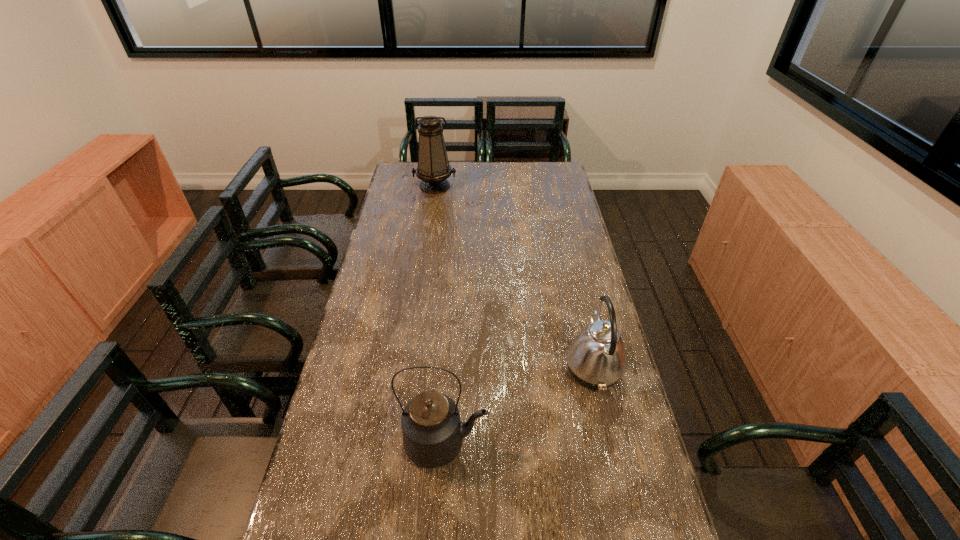
The height and width of the screenshot is (540, 960). Identify the location of object that is at the far edge. (433, 169).

Where is `object present at the left edge`? Image resolution: width=960 pixels, height=540 pixels. object present at the left edge is located at coordinates (433, 169).

This screenshot has width=960, height=540. Identify the location of object situated at the right edge. (596, 358).

The image size is (960, 540). Find the location of `object located at the far left corner`. object located at the far left corner is located at coordinates (433, 169).

In the image, there is a desktop. Where is `vacant space at the far edge`? vacant space at the far edge is located at coordinates (512, 184).

Image resolution: width=960 pixels, height=540 pixels. I want to click on free space at the left edge of the desktop, so click(401, 319).

Where is `free space at the right edge`? The image size is (960, 540). free space at the right edge is located at coordinates (577, 428).

Identify the location of unoccupied area between the farthest object and the right kettle. (514, 277).

Locate an element on the screen. vacant space in between the left kettle and the farthest object is located at coordinates (440, 315).

At what (x,y) coordinates should I click in order to perform the action: click on vacant area that lies between the shortest object and the farthest object. Please return your answer as a coordinate pair (x, y). Looking at the image, I should click on (514, 277).